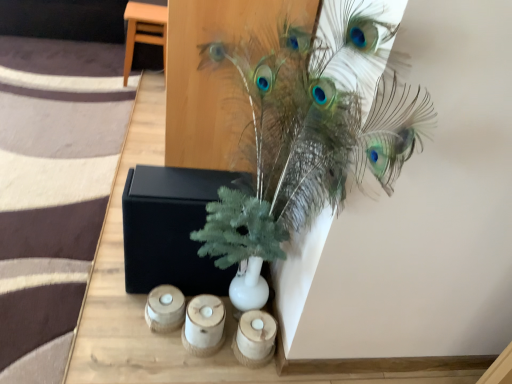
Identify the location of wooden candle holder at lower center, which is the second candle holder from right to left. Image resolution: width=512 pixels, height=384 pixels. (204, 325).

What is the approximate height of wooden candle holder at lower center, which is the third candle holder from right to left?

wooden candle holder at lower center, which is the third candle holder from right to left, is 3.42 inches tall.

Locate an element on the screen. The width and height of the screenshot is (512, 384). light brown wood stool at upper left is located at coordinates (144, 30).

Which point is more forward, [154,312] or [135,198]?

The point [135,198] is closer to the camera.

Considering the relative positions of wooden candle holder at lower center, which is the third candle holder from right to left, and black matte box at center in the image provided, is wooden candle holder at lower center, which is the third candle holder from right to left, to the right of black matte box at center from the viewer's perspective?

In fact, wooden candle holder at lower center, which is the third candle holder from right to left, is to the left of black matte box at center.

How much distance is there between wooden candle holder at lower center, which is the third candle holder from right to left, and black matte box at center?

wooden candle holder at lower center, which is the third candle holder from right to left, is 8.52 inches from black matte box at center.

Can you confirm if wooden candle holder at lower center, which is the 3th candle holder in left-to-right order, is wider than light brown wood stool at upper left?

No, wooden candle holder at lower center, which is the 3th candle holder in left-to-right order, is not wider than light brown wood stool at upper left.

Consider the image. Is wooden candle holder at lower center, placed as the 1th candle holder when sorted from right to left, placed right next to light brown wood stool at upper left?

No.

Is wooden candle holder at lower center, the 2th candle holder viewed from the left, bigger than wooden candle holder at lower center, positioned as the first candle holder in left-to-right order?

Indeed, wooden candle holder at lower center, the 2th candle holder viewed from the left, has a larger size compared to wooden candle holder at lower center, positioned as the first candle holder in left-to-right order.

Looking at this image, considering the relative sizes of wooden candle holder at lower center, which is the second candle holder from right to left, and wooden candle holder at lower center, positioned as the first candle holder in left-to-right order, in the image provided, is wooden candle holder at lower center, which is the second candle holder from right to left, thinner than wooden candle holder at lower center, positioned as the first candle holder in left-to-right order,?

Incorrect, the width of wooden candle holder at lower center, which is the second candle holder from right to left, is not less than that of wooden candle holder at lower center, positioned as the first candle holder in left-to-right order.

Is wooden candle holder at lower center, which is the second candle holder from right to left, far away from wooden candle holder at lower center, positioned as the first candle holder in left-to-right order?

That's not correct — wooden candle holder at lower center, which is the second candle holder from right to left, is a little close to wooden candle holder at lower center, positioned as the first candle holder in left-to-right order.

Which point is more distant from viewer, (205, 297) or (152, 297)?

The point (152, 297) is behind.

From a real-world perspective, who is located lower, black matte box at center or light brown wood stool at upper left?

From a 3D spatial view, black matte box at center is below.

Can you tell me how much black matte box at center and light brown wood stool at upper left differ in facing direction?

The angle between the facing direction of black matte box at center and the facing direction of light brown wood stool at upper left is 2.89 degrees.

How far apart are black matte box at center and light brown wood stool at upper left?

black matte box at center and light brown wood stool at upper left are 5.06 feet apart from each other.

Between black matte box at center and light brown wood stool at upper left, which one has less height?

black matte box at center is shorter.

Is point (201, 197) closer to camera compared to point (213, 305)?

Yes, it is.

Who is more distant, black matte box at center or wooden candle holder at lower center, the 2th candle holder viewed from the left?

Positioned behind is wooden candle holder at lower center, the 2th candle holder viewed from the left.

The height and width of the screenshot is (384, 512). Identify the location of candle holder that is the 1st one when counting rightward from the black matte box at center. (204, 325).

From the image's perspective, is black matte box at center below wooden candle holder at lower center, which is the second candle holder from right to left?

No, from the image's perspective, black matte box at center is not beneath wooden candle holder at lower center, which is the second candle holder from right to left.

From a real-world perspective, is wooden candle holder at lower center, which is the third candle holder from right to left, beneath wooden candle holder at lower center, which is the second candle holder from right to left?

Correct, in the physical world, wooden candle holder at lower center, which is the third candle holder from right to left, is lower than wooden candle holder at lower center, which is the second candle holder from right to left.

Considering the positions of points (173, 301) and (189, 340), is point (173, 301) farther from camera compared to point (189, 340)?

Yes, it is behind point (189, 340).

How much distance is there between wooden candle holder at lower center, which is the third candle holder from right to left, and wooden candle holder at lower center, which is the second candle holder from right to left?

wooden candle holder at lower center, which is the third candle holder from right to left, and wooden candle holder at lower center, which is the second candle holder from right to left, are 4.05 inches apart from each other.

Can you tell me how much wooden candle holder at lower center, positioned as the first candle holder in left-to-right order, and wooden candle holder at lower center, the 2th candle holder viewed from the left, differ in facing direction?

14 degrees separate the facing orientations of wooden candle holder at lower center, positioned as the first candle holder in left-to-right order, and wooden candle holder at lower center, the 2th candle holder viewed from the left.

Would you say wooden candle holder at lower center, which is the second candle holder from right to left, is to the left or to the right of black matte box at center in the picture?

wooden candle holder at lower center, which is the second candle holder from right to left, is to the right of black matte box at center.

Considering the sizes of objects wooden candle holder at lower center, which is the second candle holder from right to left, and black matte box at center in the image provided, who is shorter, wooden candle holder at lower center, which is the second candle holder from right to left, or black matte box at center?

wooden candle holder at lower center, which is the second candle holder from right to left.

From the image's perspective, which one is positioned higher, wooden candle holder at lower center, which is the second candle holder from right to left, or black matte box at center?

black matte box at center.

Consider the image. Is wooden candle holder at lower center, the 2th candle holder viewed from the left, aimed at black matte box at center?

No.

Where is `candle holder that is on the left side of black matte box at center`? candle holder that is on the left side of black matte box at center is located at coordinates (164, 309).

Locate an element on the screen. candle holder that is the 3rd object to the right of the light brown wood stool at upper left, starting at the anchor is located at coordinates (255, 338).

Based on their spatial positions, is green matte plant at upper center or wooden candle holder at lower center, the 2th candle holder viewed from the left, closer to wooden candle holder at lower center, which is the 3th candle holder in left-to-right order?

wooden candle holder at lower center, the 2th candle holder viewed from the left, lies closer to wooden candle holder at lower center, which is the 3th candle holder in left-to-right order, than the other object.

Which object lies further to the anchor point wooden candle holder at lower center, the 2th candle holder viewed from the left, wooden candle holder at lower center, placed as the 1th candle holder when sorted from right to left, or green matte plant at upper center?

Among the two, green matte plant at upper center is located further to wooden candle holder at lower center, the 2th candle holder viewed from the left.

From the image, which object appears to be nearer to wooden candle holder at lower center, placed as the 1th candle holder when sorted from right to left, wooden candle holder at lower center, the 2th candle holder viewed from the left, or black matte box at center?

wooden candle holder at lower center, the 2th candle holder viewed from the left, is closer to wooden candle holder at lower center, placed as the 1th candle holder when sorted from right to left.

Based on their spatial positions, is green matte plant at upper center or wooden candle holder at lower center, which is the third candle holder from right to left, closer to wooden candle holder at lower center, placed as the 1th candle holder when sorted from right to left?

wooden candle holder at lower center, which is the third candle holder from right to left, lies closer to wooden candle holder at lower center, placed as the 1th candle holder when sorted from right to left, than the other object.

From the image, which object appears to be farther from green matte plant at upper center, wooden candle holder at lower center, which is the third candle holder from right to left, or wooden candle holder at lower center, which is the second candle holder from right to left?

The object further to green matte plant at upper center is wooden candle holder at lower center, which is the third candle holder from right to left.

Which object lies nearer to the anchor point green matte plant at upper center, wooden candle holder at lower center, which is the second candle holder from right to left, or black matte box at center?

black matte box at center is closer to green matte plant at upper center.

Looking at the image, which one is located further to wooden candle holder at lower center, which is the third candle holder from right to left, wooden candle holder at lower center, which is the 3th candle holder in left-to-right order, or wooden candle holder at lower center, which is the second candle holder from right to left?

wooden candle holder at lower center, which is the 3th candle holder in left-to-right order, is further to wooden candle holder at lower center, which is the third candle holder from right to left.

When comparing their distances from wooden candle holder at lower center, which is the 3th candle holder in left-to-right order, does wooden candle holder at lower center, positioned as the first candle holder in left-to-right order, or light brown wood stool at upper left seem closer?

Based on the image, wooden candle holder at lower center, positioned as the first candle holder in left-to-right order, appears to be nearer to wooden candle holder at lower center, which is the 3th candle holder in left-to-right order.

At what (x,y) coordinates should I click in order to perform the action: click on candle holder between light brown wood stool at upper left and wooden candle holder at lower center, which is the second candle holder from right to left, in the up-down direction. Please return your answer as a coordinate pair (x, y). The image size is (512, 384). Looking at the image, I should click on (164, 309).

Where is `box positioned between green matte plant at upper center and wooden candle holder at lower center, which is the second candle holder from right to left, from near to far`? Image resolution: width=512 pixels, height=384 pixels. box positioned between green matte plant at upper center and wooden candle holder at lower center, which is the second candle holder from right to left, from near to far is located at coordinates (172, 228).

This screenshot has width=512, height=384. I want to click on candle holder located between wooden candle holder at lower center, which is the third candle holder from right to left, and wooden candle holder at lower center, which is the 3th candle holder in left-to-right order, in the left-right direction, so click(204, 325).

Where is `box between green matte plant at upper center and light brown wood stool at upper left in the front-back direction`? The height and width of the screenshot is (384, 512). box between green matte plant at upper center and light brown wood stool at upper left in the front-back direction is located at coordinates (172, 228).